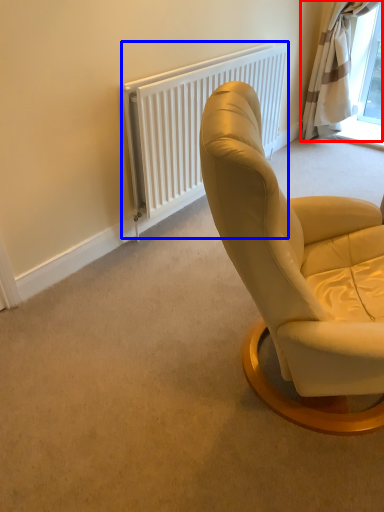
Question: Among these objects, which one is nearest to the camera, curtain (highlighted by a red box) or radiator (highlighted by a blue box)?

Choices:
 (A) curtain
 (B) radiator

Answer: (B)